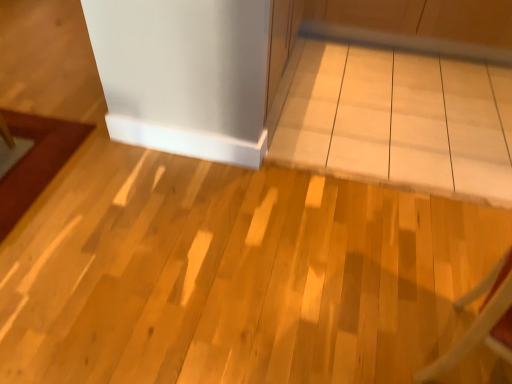
The image size is (512, 384). What are the coordinates of `white glossy table at center` in the screenshot? It's located at (396, 117).

What is the approximate height of white glossy table at center?

2.02 inches.

The height and width of the screenshot is (384, 512). Describe the element at coordinates (396, 117) in the screenshot. I see `white glossy table at center` at that location.

The height and width of the screenshot is (384, 512). I want to click on wooden chair at lower right, so click(x=482, y=321).

Describe the element at coordinates (482, 321) in the screenshot. I see `wooden chair at lower right` at that location.

What are the coordinates of `white glossy table at center` in the screenshot? It's located at (396, 117).

Is white glossy table at center to the right of wooden chair at lower right from the viewer's perspective?

No, white glossy table at center is not to the right of wooden chair at lower right.

Which is behind, white glossy table at center or wooden chair at lower right?

white glossy table at center is more distant.

Which is farther from the camera, [413,98] or [483,329]?

Point [413,98]

From the image's perspective, relative to wooden chair at lower right, is white glossy table at center above or below?

white glossy table at center is above wooden chair at lower right.

From a real-world perspective, who is located lower, white glossy table at center or wooden chair at lower right?

white glossy table at center.

Is white glossy table at center thinner than wooden chair at lower right?

Incorrect, the width of white glossy table at center is not less than that of wooden chair at lower right.

Which of these two, white glossy table at center or wooden chair at lower right, stands taller?

Standing taller between the two is wooden chair at lower right.

Does white glossy table at center have a larger size compared to wooden chair at lower right?

Correct, white glossy table at center is larger in size than wooden chair at lower right.

Is white glossy table at center inside or outside of wooden chair at lower right?

white glossy table at center exists outside the volume of wooden chair at lower right.

Is white glossy table at center directly adjacent to wooden chair at lower right?

They are not placed beside each other.

Is white glossy table at center looking in the opposite direction of wooden chair at lower right?

That's not correct — white glossy table at center is not looking away from wooden chair at lower right.

Image resolution: width=512 pixels, height=384 pixels. Find the location of `table behind the wooden chair at lower right`. table behind the wooden chair at lower right is located at coordinates (396, 117).

Based on the photo, can you confirm if wooden chair at lower right is positioned to the right of white glossy table at center?

Yes, wooden chair at lower right is to the right of white glossy table at center.

Is wooden chair at lower right closer to camera compared to white glossy table at center?

Yes, wooden chair at lower right is closer to the viewer.

Does point (503, 265) come closer to viewer compared to point (307, 111)?

Yes, point (503, 265) is in front of point (307, 111).

From the image's perspective, is wooden chair at lower right on white glossy table at center?

Incorrect, from the image's perspective, wooden chair at lower right is lower than white glossy table at center.

From a real-world perspective, is wooden chair at lower right physically above white glossy table at center?

Yes.

Which of these two, wooden chair at lower right or white glossy table at center, is wider?

With larger width is white glossy table at center.

Can you confirm if wooden chair at lower right is taller than white glossy table at center?

Indeed, wooden chair at lower right has a greater height compared to white glossy table at center.

Does wooden chair at lower right have a larger size compared to white glossy table at center?

No, wooden chair at lower right is not bigger than white glossy table at center.

Which is correct: wooden chair at lower right is inside white glossy table at center, or outside of it?

wooden chair at lower right lies outside white glossy table at center.

Is wooden chair at lower right next to white glossy table at center and touching it?

wooden chair at lower right and white glossy table at center are not in contact.

Is wooden chair at lower right facing towards white glossy table at center?

No.

Locate an element on the screen. The width and height of the screenshot is (512, 384). table on the left of wooden chair at lower right is located at coordinates (396, 117).

The height and width of the screenshot is (384, 512). I want to click on table lying on the left of wooden chair at lower right, so click(x=396, y=117).

Where is `furniture that appears in front of the white glossy table at center`? The image size is (512, 384). furniture that appears in front of the white glossy table at center is located at coordinates (482, 321).